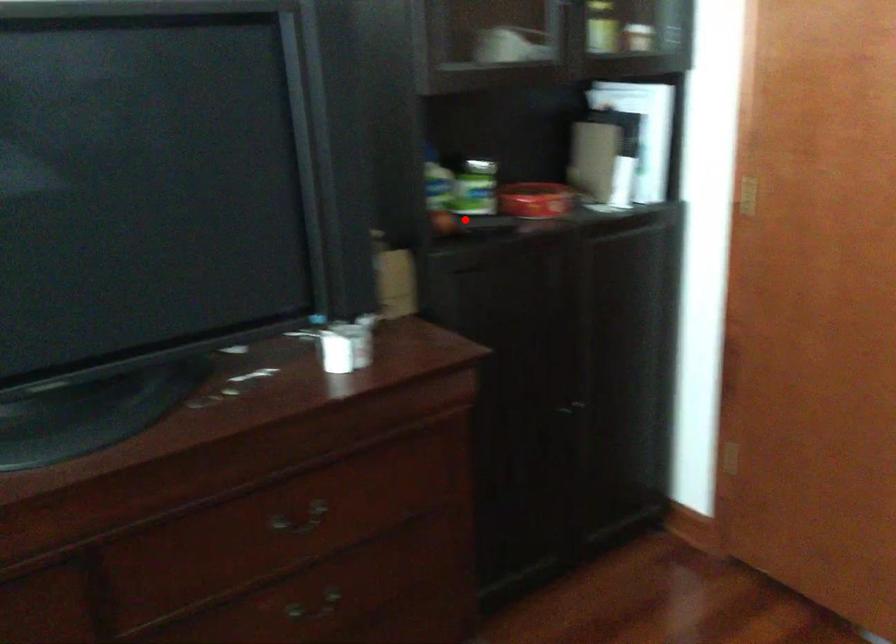
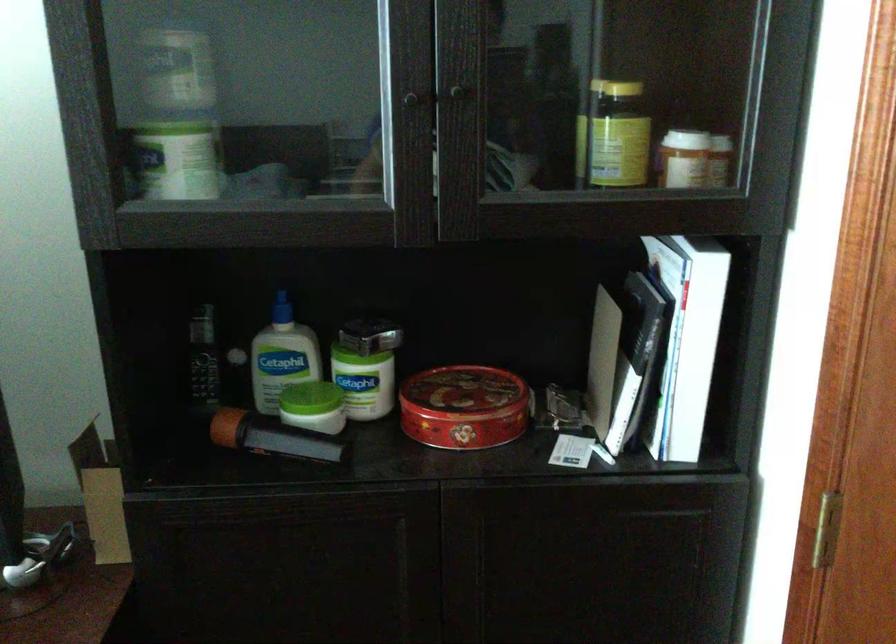
Question: A red point is marked in image1. In image2, is the corresponding 3D point closer to the camera or farther? Reply with the corresponding letter.

Choices:
 (A) The corresponding 3D point is closer.
 (B) The corresponding 3D point is farther.

Answer: (A)